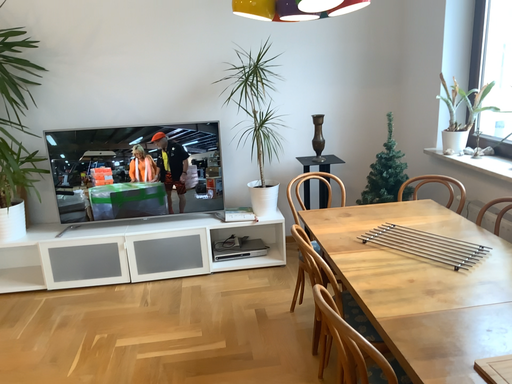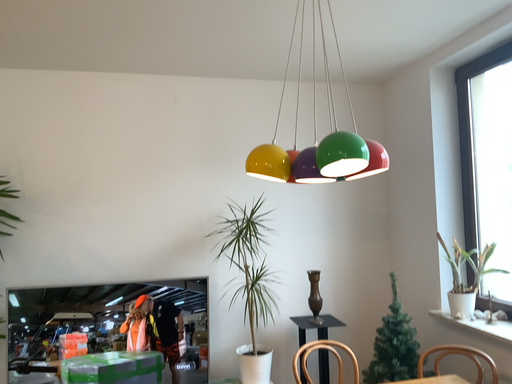
Question: How did the camera likely rotate when shooting the video?

Choices:
 (A) rotated upward
 (B) rotated downward

Answer: (A)